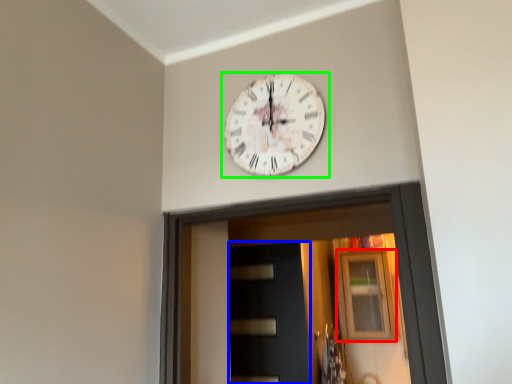
Question: Which object is the farthest from window (highlighted by a red box)? Choose among these: door (highlighted by a blue box) or wall clock (highlighted by a green box).

Choices:
 (A) door
 (B) wall clock

Answer: (B)